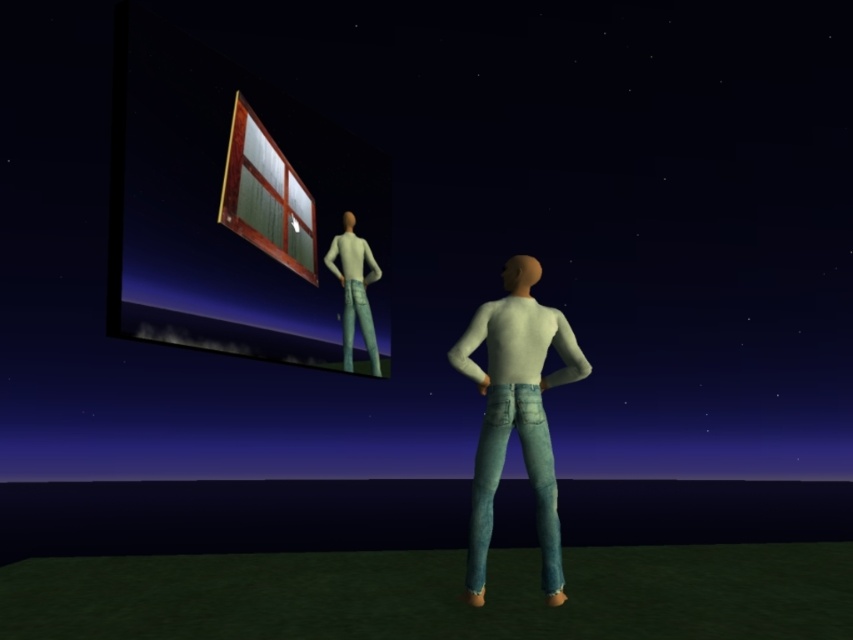
Question: Which of the following is the closest to the observer?

Choices:
 (A) (373, 257)
 (B) (310, 236)
 (C) (526, 449)

Answer: (C)

Question: Can you confirm if light blue denim jeans at center is positioned to the left of wooden frame at upper center?

Choices:
 (A) no
 (B) yes

Answer: (A)

Question: Can you confirm if light blue denim jeans at center is positioned above white matte shirt at upper center?

Choices:
 (A) no
 (B) yes

Answer: (A)

Question: Is light blue denim jeans at center thinner than wooden frame at upper center?

Choices:
 (A) no
 (B) yes

Answer: (A)

Question: Which point appears farthest from the camera in this image?

Choices:
 (A) (247, 221)
 (B) (527, 422)
 (C) (355, 257)

Answer: (C)

Question: Among these points, which one is farthest from the camera?

Choices:
 (A) (268, 145)
 (B) (363, 305)

Answer: (B)